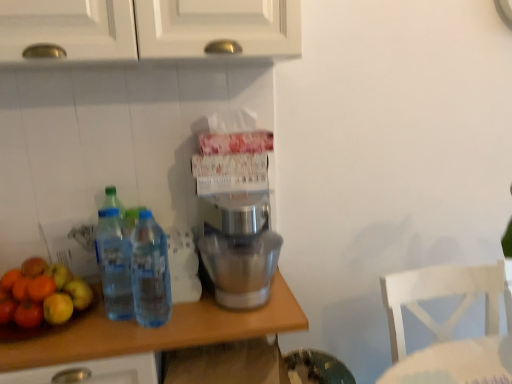
Question: Is clear wood countertop at center further to the viewer compared to transparent plastic bottles at left, the first bottle viewed from the left?

Choices:
 (A) yes
 (B) no

Answer: (B)

Question: Does clear wood countertop at center have a lesser width compared to transparent plastic bottles at left, the second bottle viewed from the right?

Choices:
 (A) yes
 (B) no

Answer: (B)

Question: Is clear wood countertop at center not inside transparent plastic bottles at left, the second bottle viewed from the right?

Choices:
 (A) yes
 (B) no

Answer: (A)

Question: Does clear wood countertop at center have a smaller size compared to transparent plastic bottles at left, the first bottle viewed from the left?

Choices:
 (A) no
 (B) yes

Answer: (A)

Question: Are clear wood countertop at center and transparent plastic bottles at left, the second bottle viewed from the right, far apart?

Choices:
 (A) no
 (B) yes

Answer: (A)

Question: Does clear wood countertop at center have a greater height compared to transparent plastic bottles at left, the second bottle viewed from the right?

Choices:
 (A) yes
 (B) no

Answer: (A)

Question: Would you say clear wood countertop at center is outside white wooden chair at lower right?

Choices:
 (A) yes
 (B) no

Answer: (A)

Question: Is clear wood countertop at center far away from white wooden chair at lower right?

Choices:
 (A) no
 (B) yes

Answer: (A)

Question: Considering the relative positions of clear wood countertop at center and white wooden chair at lower right in the image provided, is clear wood countertop at center to the right of white wooden chair at lower right from the viewer's perspective?

Choices:
 (A) yes
 (B) no

Answer: (B)

Question: From the image's perspective, is clear wood countertop at center on white wooden chair at lower right?

Choices:
 (A) no
 (B) yes

Answer: (A)

Question: Can you confirm if clear wood countertop at center is smaller than white wooden chair at lower right?

Choices:
 (A) no
 (B) yes

Answer: (A)

Question: Does clear wood countertop at center have a greater height compared to white wooden chair at lower right?

Choices:
 (A) yes
 (B) no

Answer: (A)

Question: From the image's perspective, is shiny green apple at left located beneath satin silver mixer at center?

Choices:
 (A) no
 (B) yes

Answer: (B)